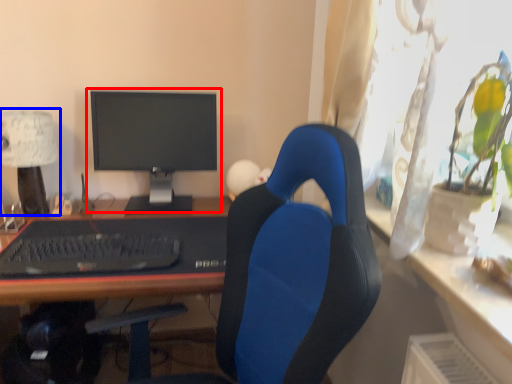
Question: Which object appears closest to the camera in this image, computer monitor (highlighted by a red box) or table lamp (highlighted by a blue box)?

Choices:
 (A) computer monitor
 (B) table lamp

Answer: (B)